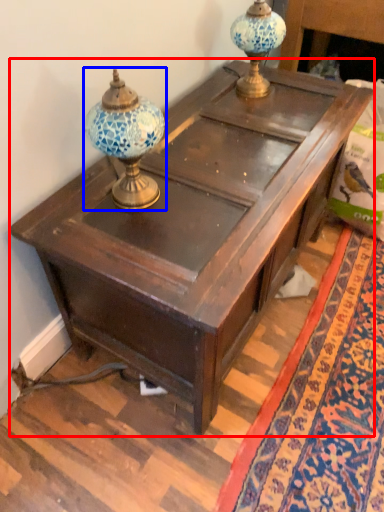
Question: Which object is further to the camera taking this photo, table (highlighted by a red box) or candle holder (highlighted by a blue box)?

Choices:
 (A) table
 (B) candle holder

Answer: (A)